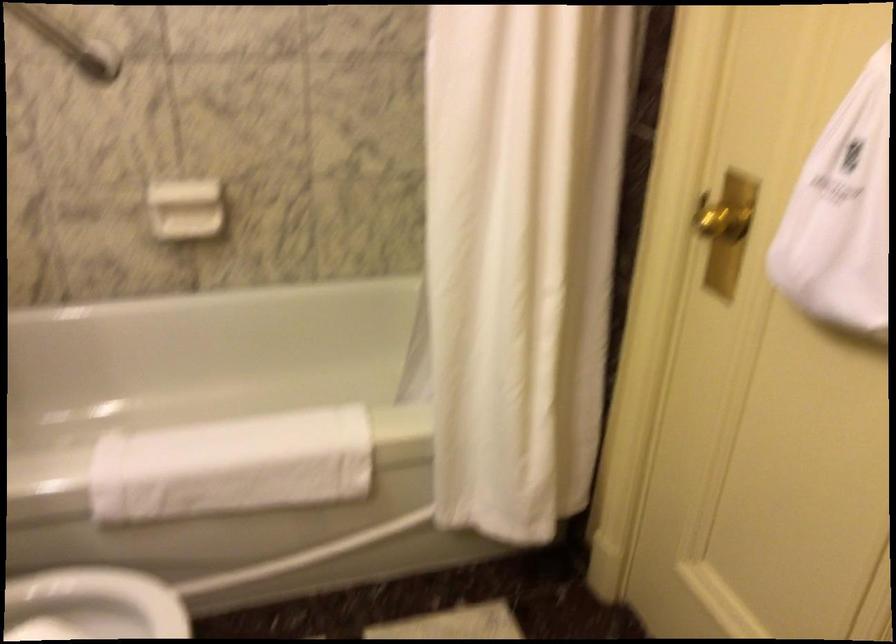
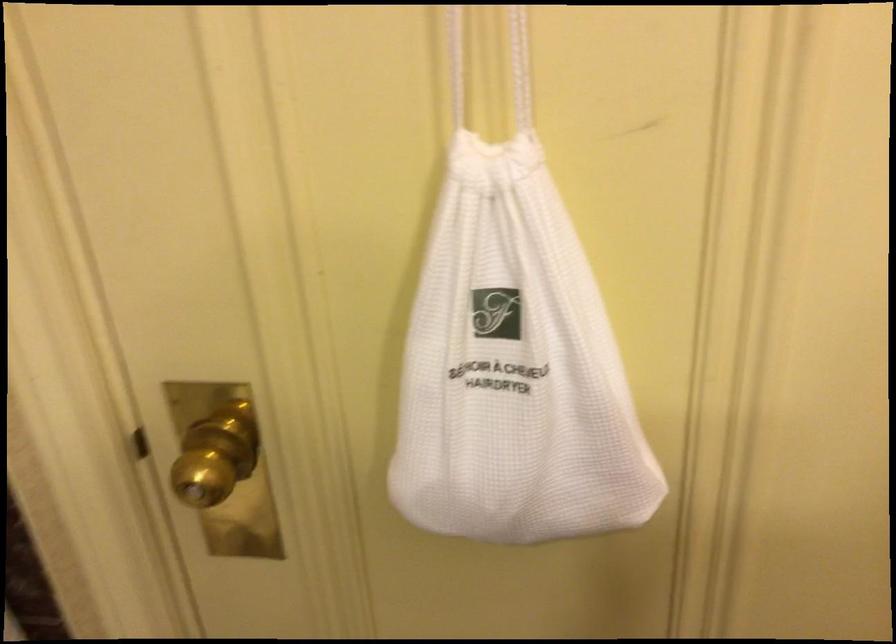
Locate, in the second image, the point that corresponds to point (727, 203) in the first image.

(216, 456)